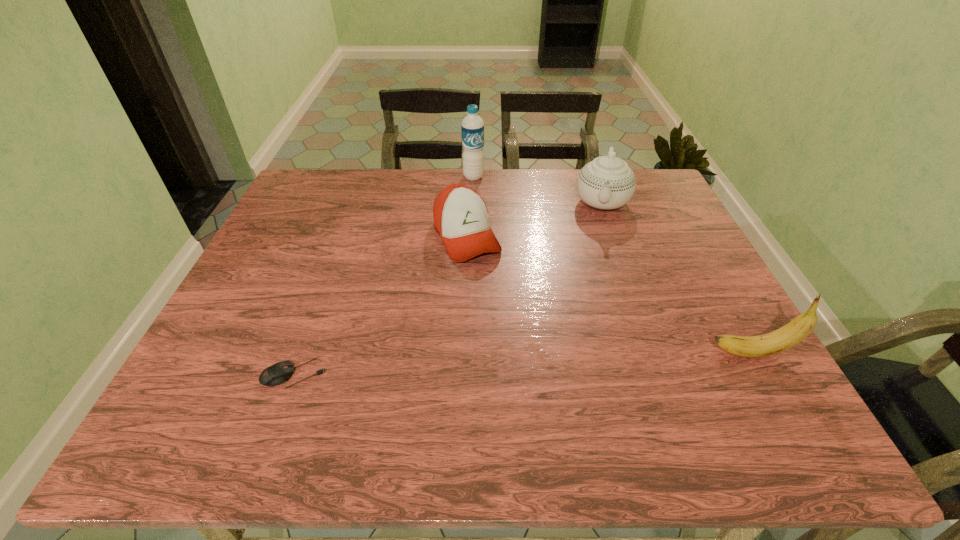
This screenshot has height=540, width=960. I want to click on water bottle at the far edge, so click(472, 127).

This screenshot has width=960, height=540. Identify the location of chinaware that is at the far edge. (607, 182).

The width and height of the screenshot is (960, 540). Find the location of `mouse located in the near edge section of the desktop`. mouse located in the near edge section of the desktop is located at coordinates (279, 373).

This screenshot has height=540, width=960. I want to click on banana located at the near edge, so click(x=784, y=338).

Locate an element on the screen. The image size is (960, 540). object situated at the left edge is located at coordinates (279, 373).

Locate an element on the screen. banana at the right edge is located at coordinates click(784, 338).

This screenshot has height=540, width=960. In order to click on chinaware positioned at the right edge in this screenshot , I will do `click(607, 182)`.

The image size is (960, 540). Find the location of `object situated at the near left corner`. object situated at the near left corner is located at coordinates (279, 373).

Image resolution: width=960 pixels, height=540 pixels. Identify the location of object that is at the far right corner. (607, 182).

Find the location of a particular element. This screenshot has width=960, height=540. object located in the near right corner section of the desktop is located at coordinates (784, 338).